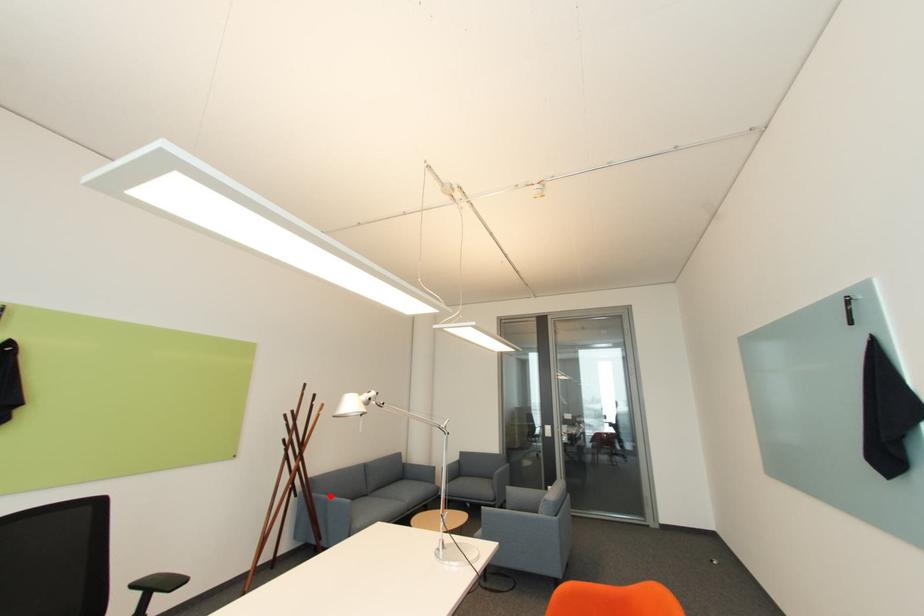
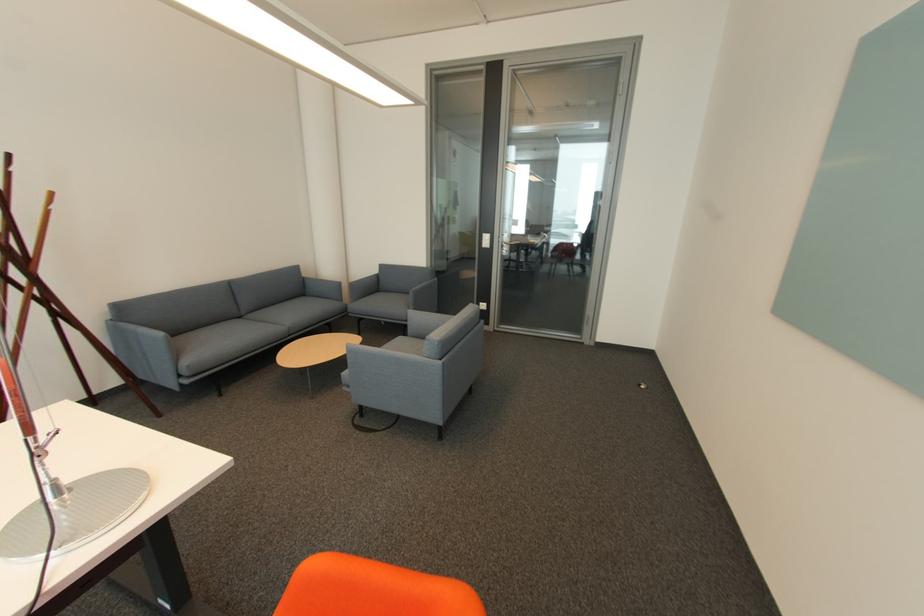
Question: I am providing you with two images of the same scene from different viewpoints. Given a red point in image1, look at the same physical point in image2. Is it:

Choices:
 (A) Closer to the viewpoint
 (B) Farther from the viewpoint

Answer: (A)